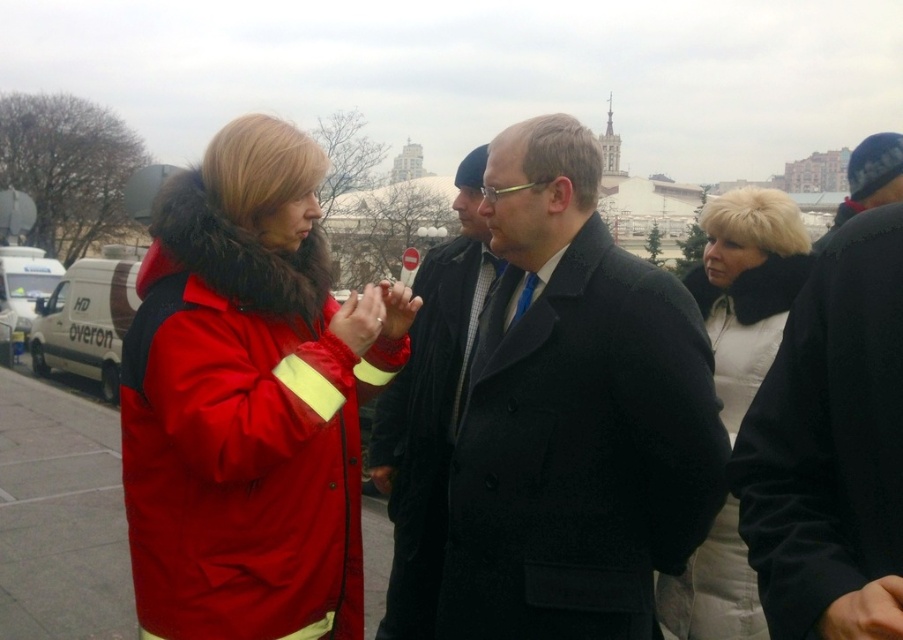
From the picture: You are a photographer trying to capture a clear shot of both the white fur collar at upper right and the white van at left. Since you can only focus on one subject at a time, which one should you choose to ensure it appears sharp in the photo?

The white fur collar at upper right is closer to the viewer than the white van at left, so focusing on it would keep it sharp while the van might be slightly blurred. Alternatively, focusing on the van would leave the collar blurred. To maximize clarity for one, choose the closer subject.

You are a photographer trying to capture a portrait of both the red fabric jacket at left and the white fur collar at upper right in the same frame. Based on their positions, which object should you focus on first to ensure both are in focus?

The red fabric jacket at left is to the left of the white fur collar at upper right, so focusing on the red fabric jacket at left first would ensure both are in focus since it is closer to the camera.

You are a photographer trying to capture a closeup shot of both the dark gray wool coat at center and the white fur collar at upper right. Given their sizes, which object will require you to move closer to get a detailed shot?

The dark gray wool coat at center occupies less space than the white fur collar at upper right, so you will need to move closer to the dark gray wool coat at center to capture its details in the closeup shot.